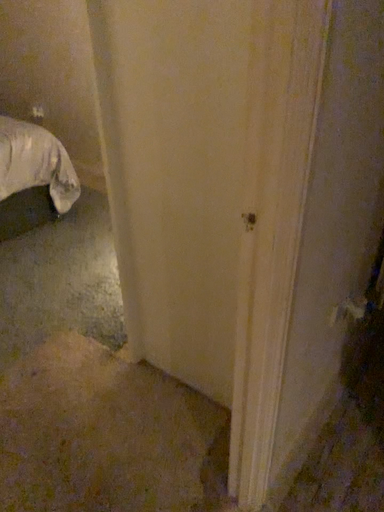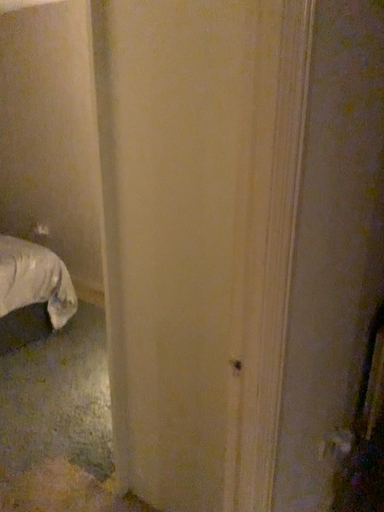
Question: How did the camera likely rotate when shooting the video?

Choices:
 (A) rotated upward
 (B) rotated downward

Answer: (A)